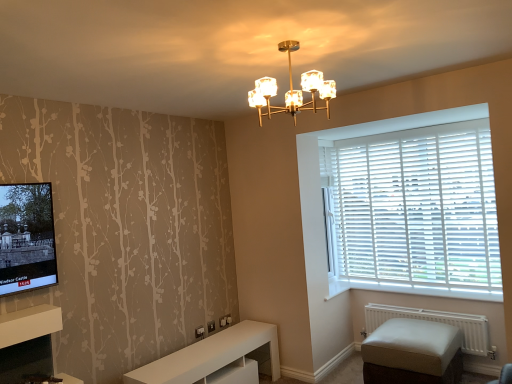
The height and width of the screenshot is (384, 512). I want to click on vacant space situated above white wood at lower right (from a real-world perspective), so 423,286.